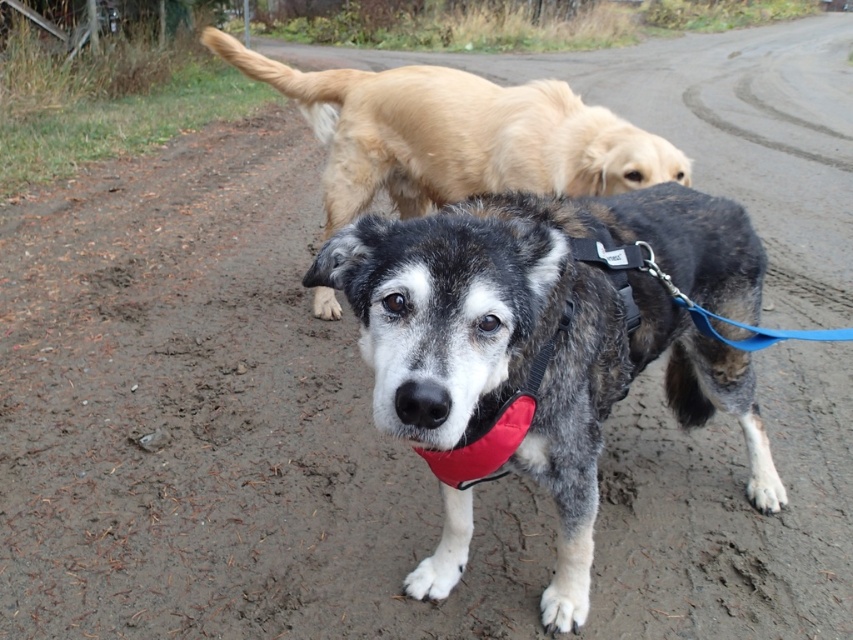
You are a photographer trying to capture a group photo of the speckled fur dog at center and the golden fur dog at upper center. If you want to ensure both dogs are in focus, which dog should you focus on first based on their positions?

The speckled fur dog at center is thinner than the golden fur dog at upper center, so you should focus on the golden fur dog at upper center first as it is larger and more prominent in the frame.